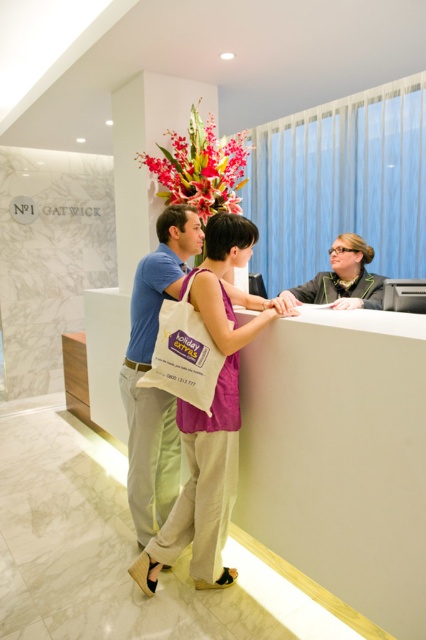
Who is positioned more to the right, vivid floral arrangement at upper center or white canvas tote at center?

white canvas tote at center

Locate an element on the screen. The image size is (426, 640). vivid floral arrangement at upper center is located at coordinates (201, 168).

Does white matte information desk at center appear on the right side of white canvas tote at center?

Yes, white matte information desk at center is to the right of white canvas tote at center.

Which of these two, white matte information desk at center or white canvas tote at center, stands taller?

Standing taller between the two is white matte information desk at center.

The height and width of the screenshot is (640, 426). Describe the element at coordinates (339, 458) in the screenshot. I see `white matte information desk at center` at that location.

Find the location of `white matte information desk at center`. white matte information desk at center is located at coordinates (339, 458).

Is light blue cotton shirt at center shorter than matte black blazer at center?

Incorrect, light blue cotton shirt at center's height does not fall short of matte black blazer at center's.

Who is taller, light blue cotton shirt at center or matte black blazer at center?

light blue cotton shirt at center is taller.

What do you see at coordinates (149, 369) in the screenshot? I see `light blue cotton shirt at center` at bounding box center [149, 369].

Where is `light blue cotton shirt at center`? The width and height of the screenshot is (426, 640). light blue cotton shirt at center is located at coordinates (149, 369).